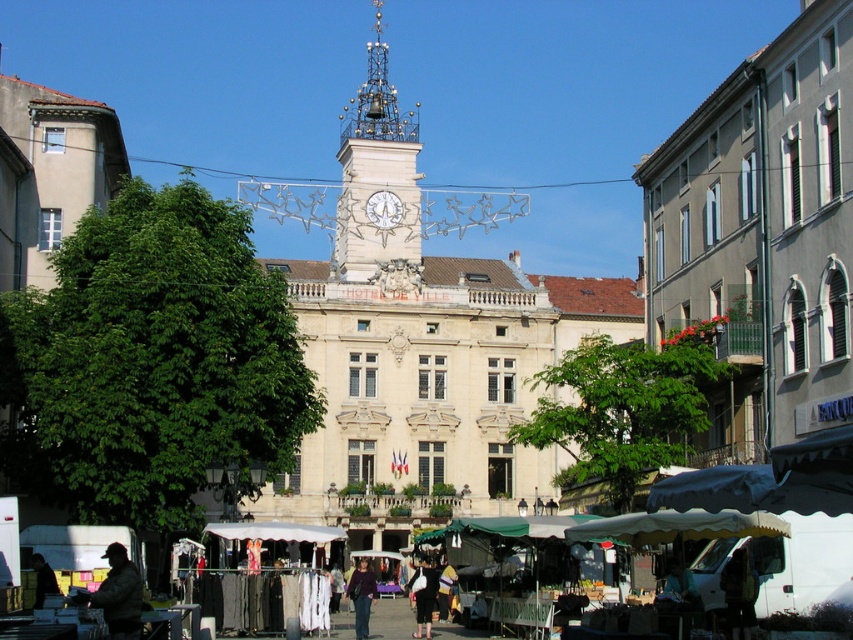
Question: Which object appears closest to the camera in this image?

Choices:
 (A) white clock face at center
 (B) black fabric dress at center

Answer: (B)

Question: Does dark purple sweater at center have a smaller size compared to white clock face at center?

Choices:
 (A) no
 (B) yes

Answer: (A)

Question: Among these points, which one is nearest to the camera?

Choices:
 (A) (416, 586)
 (B) (331, 257)
 (C) (355, 621)
 (D) (90, 602)

Answer: (D)

Question: Is camouflage jacket at lower left thinner than white clock face at center?

Choices:
 (A) no
 (B) yes

Answer: (B)

Question: Which object is closer to the camera taking this photo?

Choices:
 (A) white clock face at center
 (B) dark brown leather jacket at lower left
 (C) black fabric dress at center
 (D) dark purple sweater at center

Answer: (B)

Question: Does camouflage jacket at lower left have a greater width compared to black fabric dress at center?

Choices:
 (A) no
 (B) yes

Answer: (A)